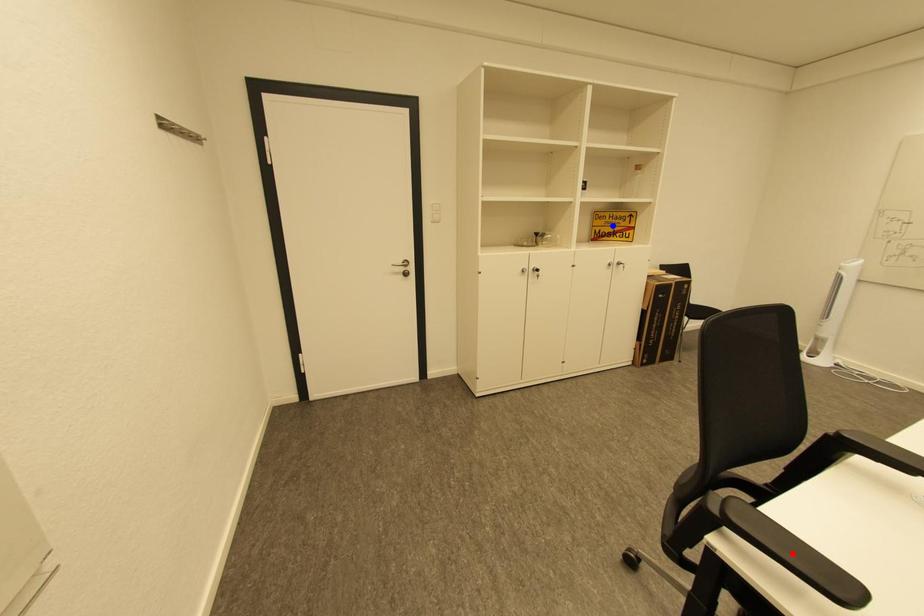
Question: Which of the two points in the image is closer to the camera?

Choices:
 (A) Blue point is closer.
 (B) Red point is closer.

Answer: (B)